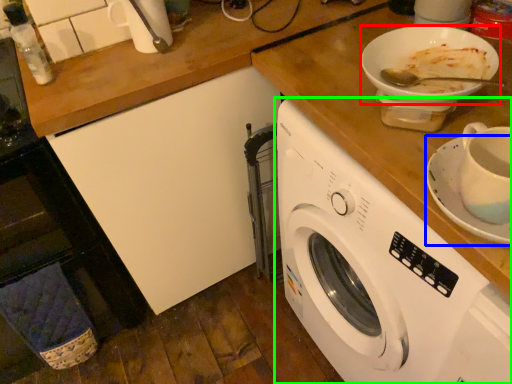
Question: Based on their relative distances, which object is nearer to tableware (highlighted by a red box)? Choose from saucer (highlighted by a blue box) and washing machine (highlighted by a green box).

Choices:
 (A) saucer
 (B) washing machine

Answer: (A)